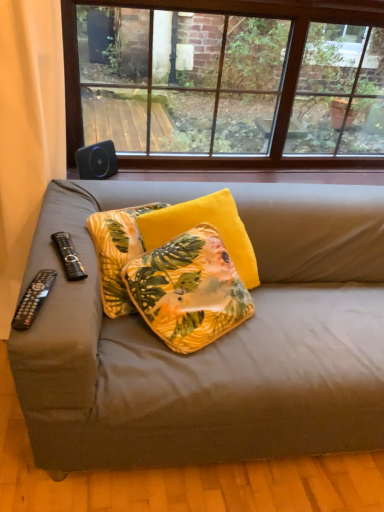
The image size is (384, 512). I want to click on vacant space to the right of black plastic remote at lower left, which is counted as the 2th remote control, starting from the top, so coord(71,308).